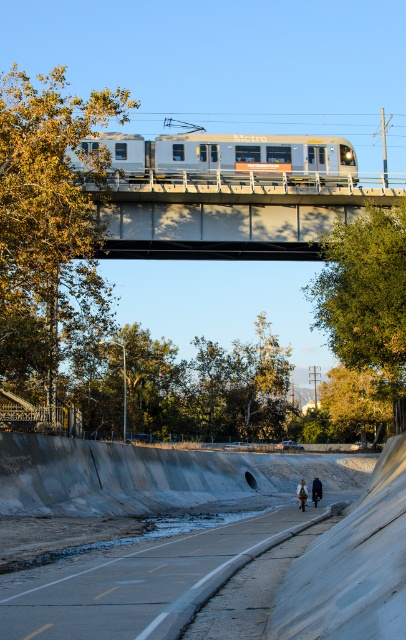
Can you confirm if gray concrete sidewalk at lower center is positioned above silver metallic train at upper center?

Actually, gray concrete sidewalk at lower center is below silver metallic train at upper center.

This screenshot has height=640, width=406. In order to click on gray concrete sidewalk at lower center in this screenshot , I will do `click(138, 580)`.

Is point (166, 547) less distant than point (284, 140)?

Yes, point (166, 547) is in front of point (284, 140).

The height and width of the screenshot is (640, 406). I want to click on gray concrete sidewalk at lower center, so click(138, 580).

Can you confirm if metal/textured bridge at upper center is positioned below gray concrete sidewalk at lower center?

No.

Is metal/textured bridge at upper center behind gray concrete sidewalk at lower center?

Yes, it is behind gray concrete sidewalk at lower center.

Between point (97, 244) and point (151, 609), which one is positioned behind?

Positioned behind is point (97, 244).

This screenshot has height=640, width=406. I want to click on metal/textured bridge at upper center, so click(230, 211).

Can you confirm if metal/textured bridge at upper center is smaller than silver metallic train at upper center?

Yes, metal/textured bridge at upper center is smaller than silver metallic train at upper center.

Between point (190, 193) and point (174, 136), which one is positioned in front?

Point (190, 193) is in front.

The width and height of the screenshot is (406, 640). What are the coordinates of `metal/textured bridge at upper center` in the screenshot? It's located at [230, 211].